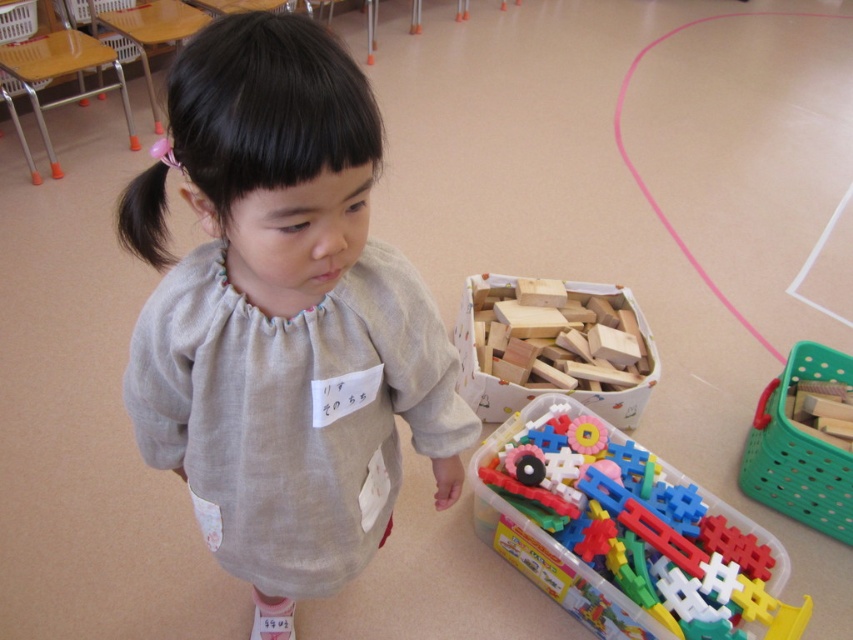
Question: Is gray cotton shirt at center closer to camera compared to wooden blocks at center?

Choices:
 (A) yes
 (B) no

Answer: (A)

Question: Which point is closer to the camera?

Choices:
 (A) wooden blocks at center
 (B) green plastic basket at right
 (C) gray cotton shirt at center

Answer: (C)

Question: Is gray cotton shirt at center positioned in front of wooden blocks at center?

Choices:
 (A) yes
 (B) no

Answer: (A)

Question: Which of these objects is positioned farthest from the wooden blocks at center?

Choices:
 (A) green plastic basket at right
 (B) plastic colorful blocks at lower right
 (C) gray cotton shirt at center

Answer: (C)

Question: Can you confirm if wooden blocks at center is wider than green plastic basket at right?

Choices:
 (A) yes
 (B) no

Answer: (A)

Question: Based on their relative distances, which object is farther from the plastic colorful blocks at lower right?

Choices:
 (A) green plastic basket at right
 (B) wooden blocks at center

Answer: (A)